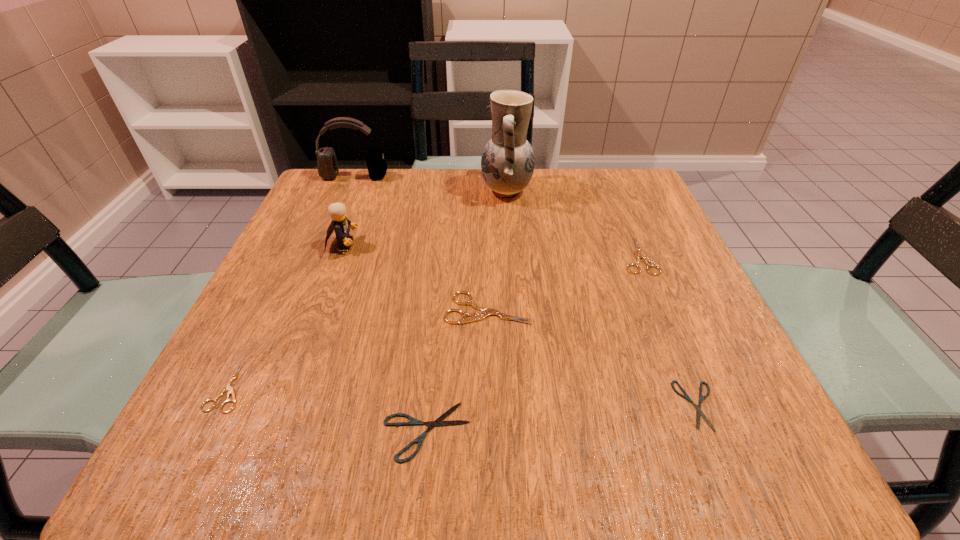
You are a GUI agent. You are given a task and a screenshot of the screen. Output one action in this format:
    pyautogui.click(x=<x>, y=<y>)
    Task: Click on the blank space located on the right of the nearest beige shears
    
    Given the screenshot: What is the action you would take?
    pyautogui.click(x=285, y=387)

Locate an element on the screen. This screenshot has width=960, height=540. vacant region located 0.240m on the left of the bigger black shears is located at coordinates (208, 431).

The image size is (960, 540). I want to click on free space located on the left of the smaller black shears, so click(610, 406).

The width and height of the screenshot is (960, 540). In order to click on pottery that is at the far edge in this screenshot , I will do `click(507, 163)`.

The height and width of the screenshot is (540, 960). What are the coordinates of `headset located in the far edge section of the desktop` in the screenshot? It's located at (328, 169).

This screenshot has width=960, height=540. Identify the location of headset situated at the left edge. (328, 169).

In order to click on Lego that is at the left edge in this screenshot , I will do `click(340, 224)`.

Where is `shears positioned at the left edge`? shears positioned at the left edge is located at coordinates (227, 387).

Locate an element on the screen. Image resolution: width=960 pixels, height=540 pixels. object at the far left corner is located at coordinates (328, 169).

Find the location of a particular element. Image resolution: width=960 pixels, height=540 pixels. object located at the near left corner is located at coordinates (227, 387).